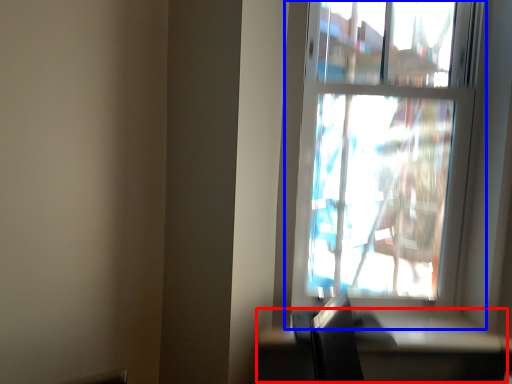
Question: Which object is closer to the camera taking this photo, table (highlighted by a red box) or window (highlighted by a blue box)?

Choices:
 (A) table
 (B) window

Answer: (A)